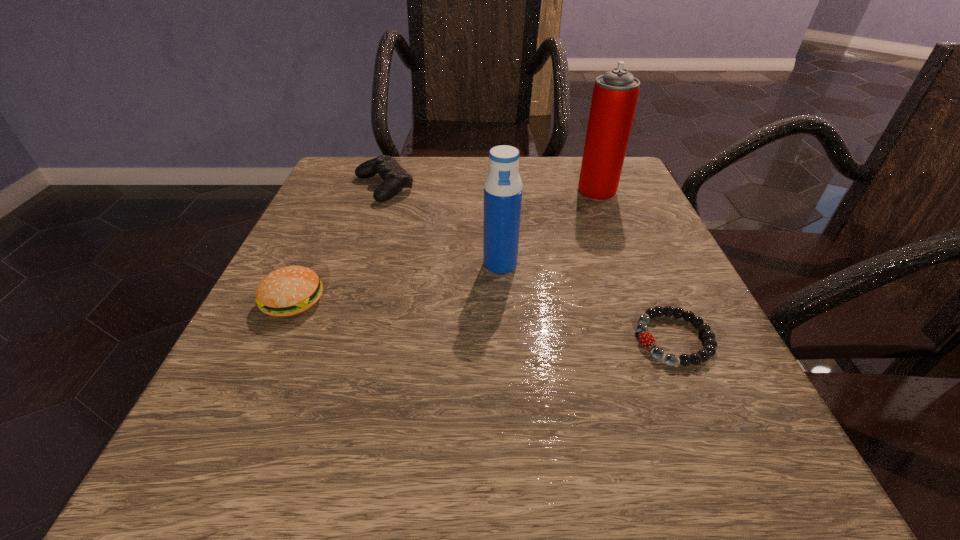
Locate an element on the screen. The image size is (960, 540). free space located on the front of the shortest object is located at coordinates (713, 429).

At what (x,y) coordinates should I click in order to perform the action: click on aerosol can that is positioned at the far edge. Please return your answer as a coordinate pair (x, y). Looking at the image, I should click on (615, 94).

Where is `control present at the far edge`? This screenshot has height=540, width=960. control present at the far edge is located at coordinates (395, 178).

Locate an element on the screen. control present at the left edge is located at coordinates (395, 178).

The height and width of the screenshot is (540, 960). I want to click on patty that is at the left edge, so click(x=287, y=291).

This screenshot has width=960, height=540. I want to click on aerosol can situated at the right edge, so click(615, 94).

The width and height of the screenshot is (960, 540). What are the coordinates of `bracelet that is at the right edge` in the screenshot? It's located at (646, 339).

Where is `object that is positioned at the far left corner`? The width and height of the screenshot is (960, 540). object that is positioned at the far left corner is located at coordinates (395, 178).

Identify the location of object that is at the far right corner. The width and height of the screenshot is (960, 540). (615, 94).

Find the location of a particular element. This screenshot has width=960, height=540. free region at the far edge of the desktop is located at coordinates (394, 199).